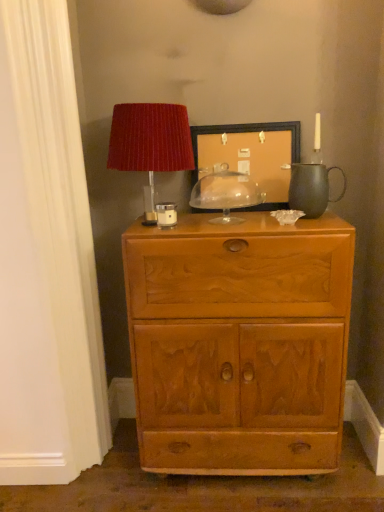
Find the location of a particular element. Image resolution: width=384 pixels, height=512 pixels. vacant space to the right of matte white candle holder at upper center, the 2th candle holder from the back is located at coordinates (211, 223).